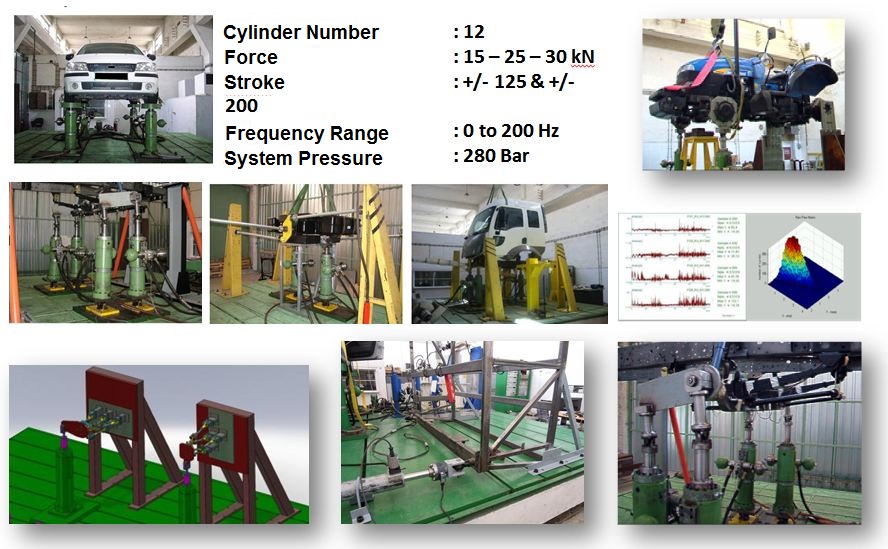
In order to click on green floor in this screenshot , I will do pyautogui.click(x=408, y=498).